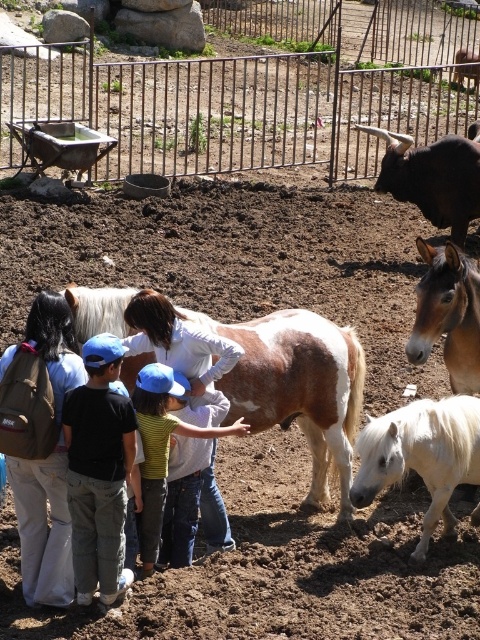
Does brushed metal fence at upper center have a smaller size compared to brown and white textured horse at center?

Incorrect, brushed metal fence at upper center is not smaller in size than brown and white textured horse at center.

Consider the image. Which of these two, brushed metal fence at upper center or brown and white textured horse at center, stands shorter?

With less height is brown and white textured horse at center.

Does point (145, 125) come farther from viewer compared to point (66, 291)?

That is True.

This screenshot has height=640, width=480. I want to click on brushed metal fence at upper center, so click(x=232, y=108).

Does brown and white textured horse at center have a greater width compared to striped shirt at center?

Indeed, brown and white textured horse at center has a greater width compared to striped shirt at center.

At what (x,y) coordinates should I click in order to perform the action: click on brown and white textured horse at center. Please return your answer as a coordinate pair (x, y). This screenshot has height=640, width=480. Looking at the image, I should click on (297, 387).

This screenshot has height=640, width=480. Find the location of `brown and white textured horse at center`. brown and white textured horse at center is located at coordinates (297, 387).

This screenshot has width=480, height=640. Describe the element at coordinates (232, 108) in the screenshot. I see `brushed metal fence at upper center` at that location.

Does brushed metal fence at upper center appear over brown backpack at left?

Yes, brushed metal fence at upper center is above brown backpack at left.

Does point (396, 1) come farther from viewer compared to point (56, 593)?

Yes, it is.

This screenshot has width=480, height=640. I want to click on brushed metal fence at upper center, so click(232, 108).